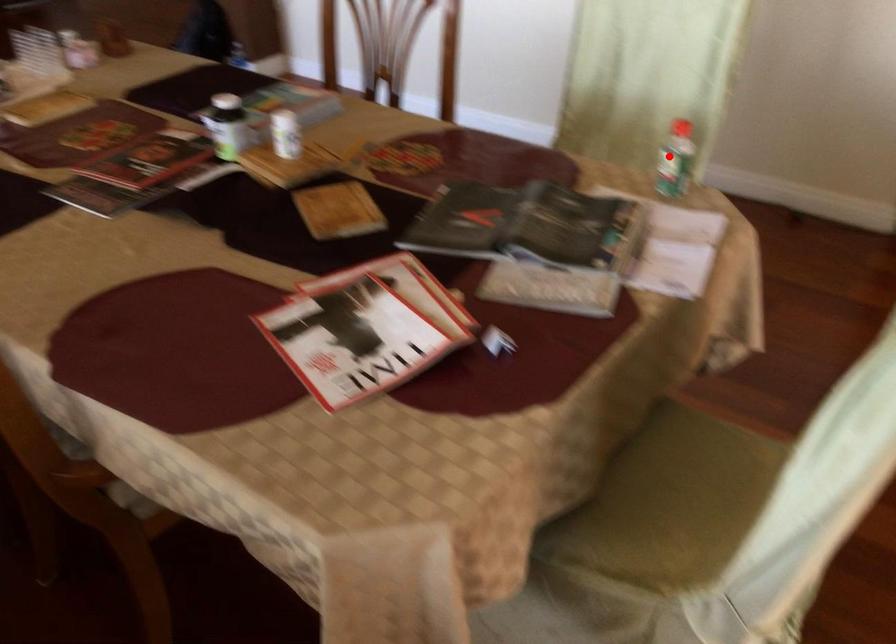
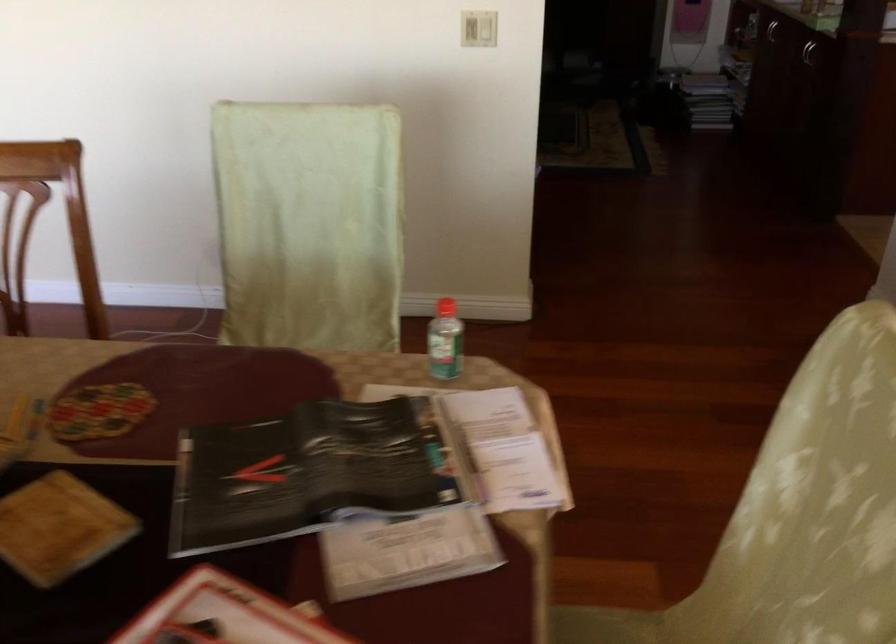
Question: A red point is marked in image1. In image2, is the corresponding 3D point closer to the camera or farther? Reply with the corresponding letter.

Choices:
 (A) The corresponding 3D point is closer.
 (B) The corresponding 3D point is farther.

Answer: (A)